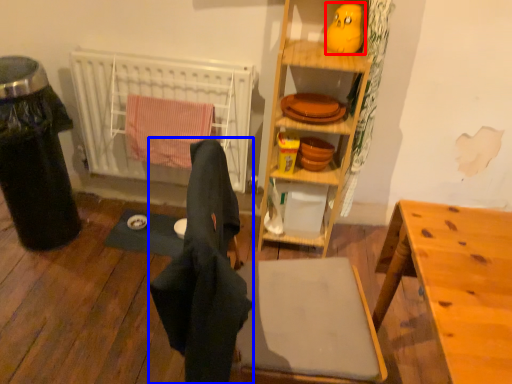
Question: Which object appears farthest to the camera in this image, toy (highlighted by a red box) or laundry (highlighted by a blue box)?

Choices:
 (A) toy
 (B) laundry

Answer: (A)